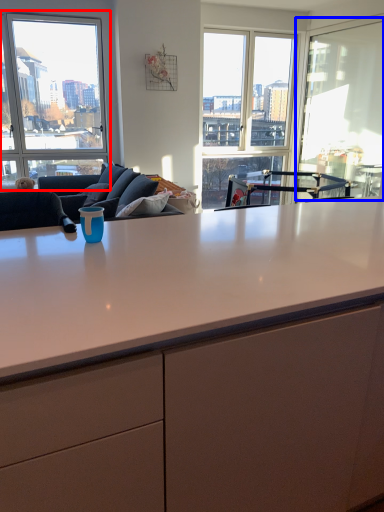
Question: Which object is further to the camera taking this photo, window (highlighted by a red box) or window screen (highlighted by a blue box)?

Choices:
 (A) window
 (B) window screen

Answer: (A)